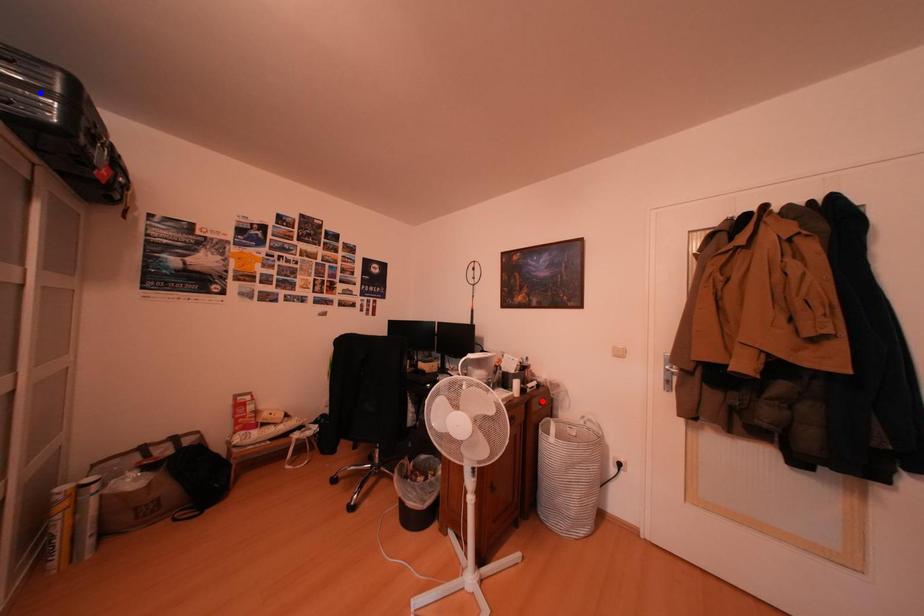
Question: In the image, two points are highlighted. Which point is nearer to the camera? Reply with the corresponding letter.

Choices:
 (A) blue point
 (B) red point

Answer: (A)